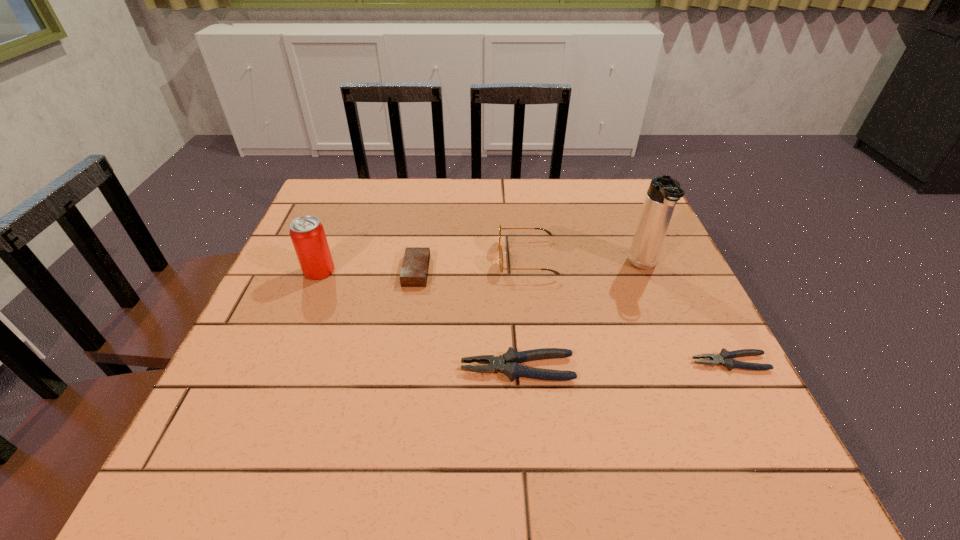
Image resolution: width=960 pixels, height=540 pixels. Identify the location of blank area located 0.380m at the gripping part of the taller pliers. (257, 368).

This screenshot has width=960, height=540. In order to click on vacant space located 0.360m at the gripping part of the shortest object in this screenshot , I will do `click(502, 362)`.

Where is `vacant space located at the gripping part of the shortest object`? The height and width of the screenshot is (540, 960). vacant space located at the gripping part of the shortest object is located at coordinates (492, 362).

The width and height of the screenshot is (960, 540). I want to click on free location located 0.330m at the gripping part of the shortest object, so click(x=517, y=362).

You are a GUI agent. You are given a task and a screenshot of the screen. Output one action in this format:
    pyautogui.click(x=<x>, y=<y>)
    Task: Click on the free space located 0.260m on the front of the fifth shortest object
    
    Given the screenshot: What is the action you would take?
    pyautogui.click(x=276, y=377)

The width and height of the screenshot is (960, 540). Find the location of `free space located 0.250m on the lenses of the sunglasses`. free space located 0.250m on the lenses of the sunglasses is located at coordinates (394, 259).

Image resolution: width=960 pixels, height=540 pixels. Find the location of `vacant space situated 0.320m on the lenses of the sunglasses`. vacant space situated 0.320m on the lenses of the sunglasses is located at coordinates (365, 259).

Locate an element on the screen. This screenshot has width=960, height=540. vacant space situated 0.320m on the lenses of the sunglasses is located at coordinates (365, 259).

Find the location of `vacant space situated 0.110m on the handle side of the tallest object`. vacant space situated 0.110m on the handle side of the tallest object is located at coordinates (664, 316).

Locate an element on the screen. This screenshot has height=540, width=960. vacant space situated 0.390m on the front face of the second object from left to right is located at coordinates (596, 271).